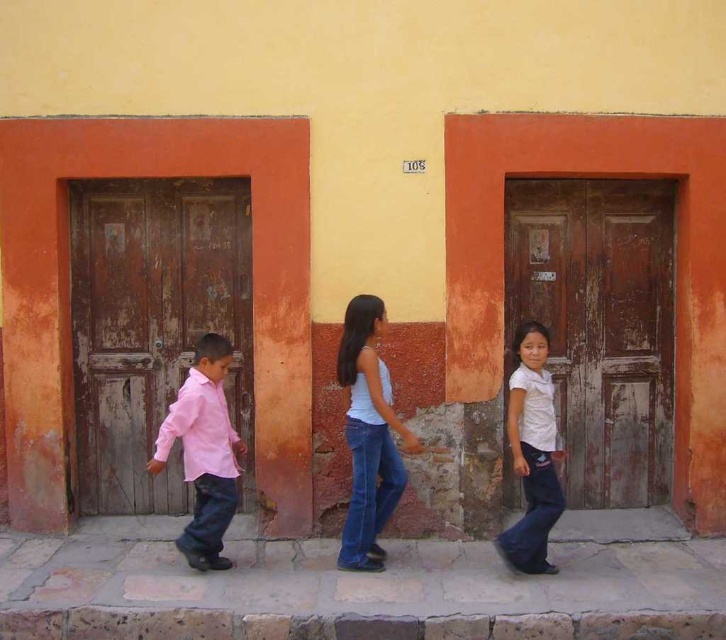
Question: Among these points, which one is nearest to the camera?

Choices:
 (A) (154, 323)
 (B) (518, 557)

Answer: (B)

Question: From the image, what is the correct spatial relationship of wooden door at left in relation to white matte shirt at center?

Choices:
 (A) left
 (B) right

Answer: (A)

Question: Estimate the real-world distances between objects in this image. Which object is closer to the pink matte shirt at left?

Choices:
 (A) white matte tank top at center
 (B) white matte shirt at center
 (C) wooden door at right

Answer: (A)

Question: Among these points, which one is farthest from the camera?

Choices:
 (A) (523, 330)
 (B) (114, 275)

Answer: (B)

Question: Where is white matte tank top at center located in relation to pink matte shirt at left in the image?

Choices:
 (A) above
 (B) below

Answer: (A)

Question: Does wooden door at left have a greater width compared to white matte shirt at center?

Choices:
 (A) yes
 (B) no

Answer: (A)